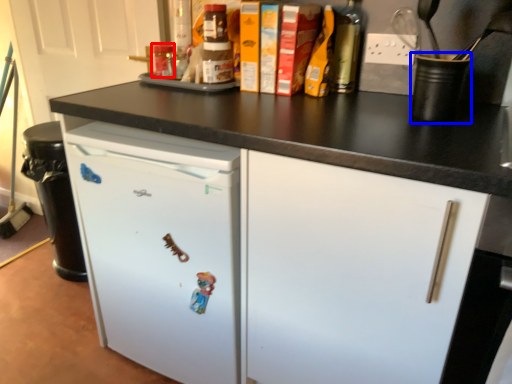
Question: Which object is closer to the camera taking this photo, bottle (highlighted by a red box) or appliance (highlighted by a blue box)?

Choices:
 (A) bottle
 (B) appliance

Answer: (B)